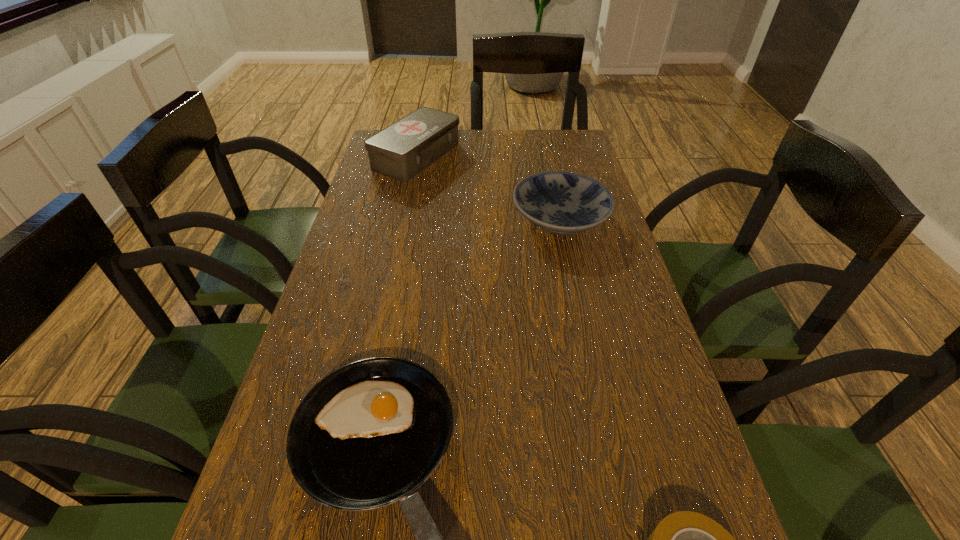
Locate an element on the screen. the tallest object is located at coordinates (404, 149).

You are a GUI agent. You are given a task and a screenshot of the screen. Output one action in this format:
    pyautogui.click(x=<x>, y=<y>)
    Task: Click on the farthest object
    
    Given the screenshot: What is the action you would take?
    pyautogui.click(x=404, y=149)

Locate an element on the screen. the third nearest object is located at coordinates (560, 202).

This screenshot has height=540, width=960. I want to click on the third shortest object, so (x=560, y=202).

Locate an element on the screen. This screenshot has height=540, width=960. free space located on the front of the tallest object is located at coordinates (401, 228).

I want to click on free space located on the back of the second tallest object, so click(552, 180).

Identify the location of object present at the far edge. This screenshot has height=540, width=960. (404, 149).

Image resolution: width=960 pixels, height=540 pixels. I want to click on object present at the left edge, so click(404, 149).

Find the location of a particular element. Image resolution: width=960 pixels, height=540 pixels. object at the right edge is located at coordinates (560, 202).

Locate an element on the screen. This screenshot has width=960, height=540. object located in the far left corner section of the desktop is located at coordinates (404, 149).